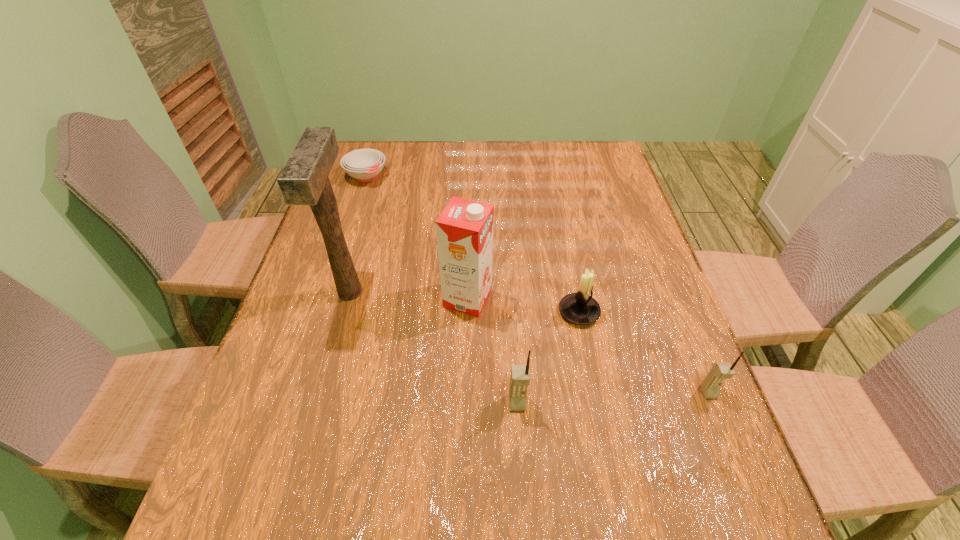
Locate an element on the screen. object that is at the far left corner is located at coordinates (364, 165).

You are a GUI agent. You are given a task and a screenshot of the screen. Output one action in this format:
    pyautogui.click(x=<x>, y=<y>)
    Task: Click on the blank space at the far edge of the desktop
    This screenshot has height=540, width=960.
    Given the screenshot: What is the action you would take?
    pyautogui.click(x=555, y=141)

You are a GUI agent. You are given a task and a screenshot of the screen. Output one action in this format:
    pyautogui.click(x=<x>, y=<y>)
    Task: Click on the vacant space at the near edge
    The height and width of the screenshot is (540, 960).
    Given the screenshot: What is the action you would take?
    pyautogui.click(x=500, y=466)

Find the location of a particular element. The height and width of the screenshot is (540, 960). vacant region at the left edge of the desktop is located at coordinates (299, 280).

At what (x,y) coordinates should I click in order to perform the action: click on vacant region at the right edge of the desktop. Please return your answer as a coordinate pair (x, y). Looking at the image, I should click on (609, 188).

Locate an element on the screen. vacant space at the far left corner is located at coordinates (390, 145).

Find the location of a particular element. The height and width of the screenshot is (540, 960). free space between the second object from right to left and the fourth object from right to left is located at coordinates (523, 305).

The image size is (960, 540). In order to click on unoccupied position between the carton and the second object from right to left in this screenshot , I will do `click(523, 305)`.

This screenshot has width=960, height=540. Find the location of `blank region between the carton and the mallet`. blank region between the carton and the mallet is located at coordinates (409, 295).

At what (x,y) coordinates should I click in order to perform the action: click on free point between the fourth object from left to right and the mallet. Please return your answer as a coordinate pair (x, y). This screenshot has height=540, width=960. Looking at the image, I should click on (434, 348).